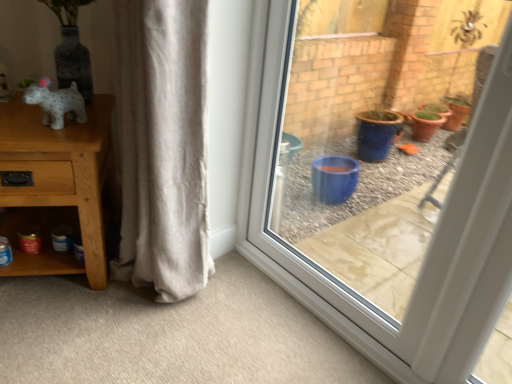
Question: Is speckled white dog at left not close to beige cotton curtain at center?

Choices:
 (A) no
 (B) yes

Answer: (A)

Question: Can you confirm if speckled white dog at left is positioned to the right of beige cotton curtain at center?

Choices:
 (A) yes
 (B) no

Answer: (B)

Question: From the image's perspective, is speckled white dog at left above beige cotton curtain at center?

Choices:
 (A) no
 (B) yes

Answer: (B)

Question: Does speckled white dog at left have a lesser width compared to beige cotton curtain at center?

Choices:
 (A) yes
 (B) no

Answer: (A)

Question: Is speckled white dog at left not within beige cotton curtain at center?

Choices:
 (A) yes
 (B) no

Answer: (A)

Question: Is speckled white dog at left turned away from beige cotton curtain at center?

Choices:
 (A) yes
 (B) no

Answer: (B)

Question: Is transparent glass window at center completely or partially outside of beige cotton curtain at center?

Choices:
 (A) no
 (B) yes

Answer: (B)

Question: From the image's perspective, is transparent glass window at center below beige cotton curtain at center?

Choices:
 (A) yes
 (B) no

Answer: (A)

Question: Is transparent glass window at center positioned behind beige cotton curtain at center?

Choices:
 (A) no
 (B) yes

Answer: (A)

Question: From a real-world perspective, is transparent glass window at center physically above beige cotton curtain at center?

Choices:
 (A) yes
 (B) no

Answer: (A)

Question: Is transparent glass window at center closer to the viewer compared to beige cotton curtain at center?

Choices:
 (A) yes
 (B) no

Answer: (A)

Question: Can you confirm if transparent glass window at center is bigger than beige cotton curtain at center?

Choices:
 (A) no
 (B) yes

Answer: (B)

Question: Considering the relative sizes of speckled white dog at left and wooden table at left in the image provided, is speckled white dog at left taller than wooden table at left?

Choices:
 (A) no
 (B) yes

Answer: (A)